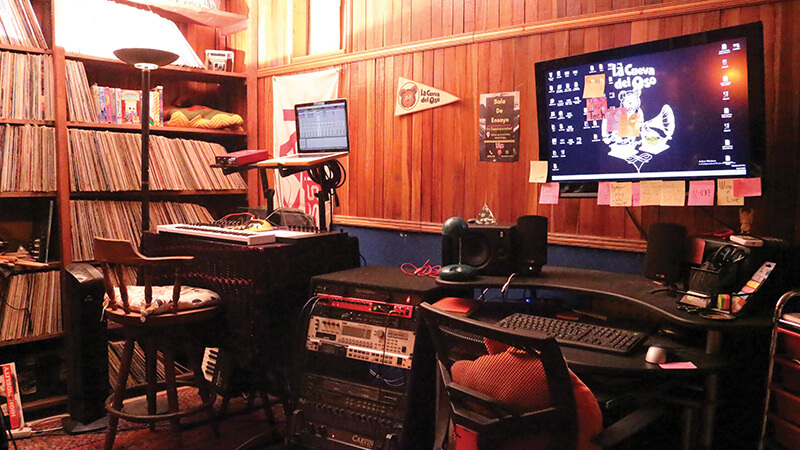
Locate an element on the screen. The height and width of the screenshot is (450, 800). the largest monitor is located at coordinates (694, 88).